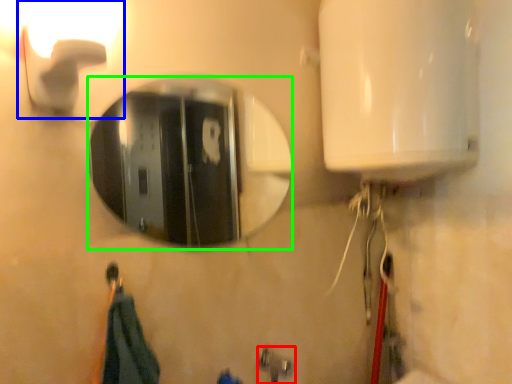
Question: Which object is positioned closest to plumbing fixture (highlighted by a red box)? Select from light fixture (highlighted by a blue box) and mirror (highlighted by a green box).

Choices:
 (A) light fixture
 (B) mirror

Answer: (A)